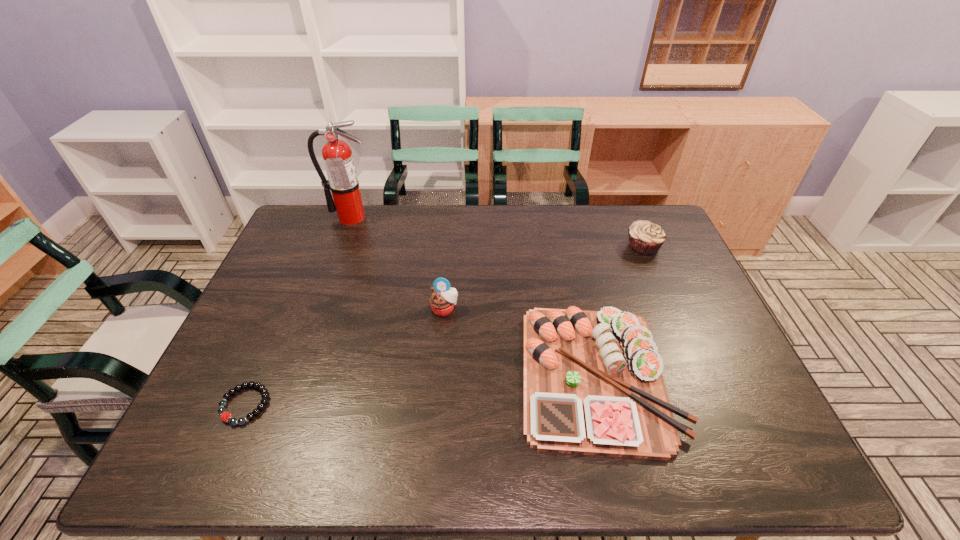
Identify the location of free space located 0.260m on the front of the farther muffin. (674, 319).

Find the location of a particular element. The width and height of the screenshot is (960, 540). free space located 0.180m on the left of the fourth tallest object is located at coordinates (446, 375).

Locate an element on the screen. The image size is (960, 540). vacant space positioned on the back of the bracelet is located at coordinates (284, 314).

Where is `fire extinguisher that is at the far edge`? This screenshot has height=540, width=960. fire extinguisher that is at the far edge is located at coordinates point(337,155).

Find the location of a particular element. muffin that is at the far edge is located at coordinates (645, 238).

Locate an element on the screen. This screenshot has height=540, width=960. object located in the near edge section of the desktop is located at coordinates (593, 381).

Locate an element on the screen. This screenshot has height=540, width=960. fire extinguisher that is positioned at the left edge is located at coordinates point(337,155).

At what (x,y) coordinates should I click in order to perform the action: click on bracelet that is at the left edge. Please return your answer as a coordinate pair (x, y). Image resolution: width=960 pixels, height=540 pixels. Looking at the image, I should click on (225, 416).

Image resolution: width=960 pixels, height=540 pixels. In order to click on object at the right edge in this screenshot , I will do `click(645, 238)`.

The width and height of the screenshot is (960, 540). Identify the location of object that is at the far left corner. (337, 155).